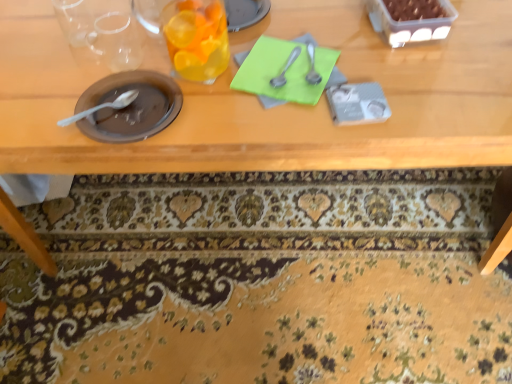
This screenshot has width=512, height=384. Identify the location of free space to the left of translucent glass at upper center, the second tableware when ordered from left to right. (114, 62).